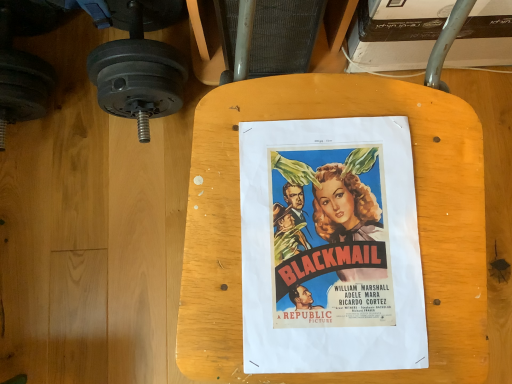
Where is `free location in front of matte black dumbbell at left`? The height and width of the screenshot is (384, 512). free location in front of matte black dumbbell at left is located at coordinates (114, 198).